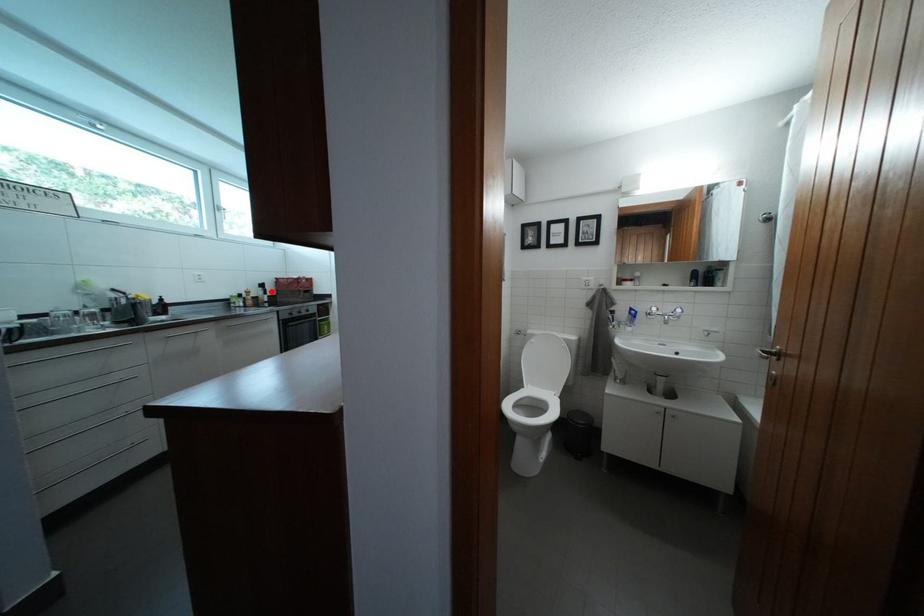
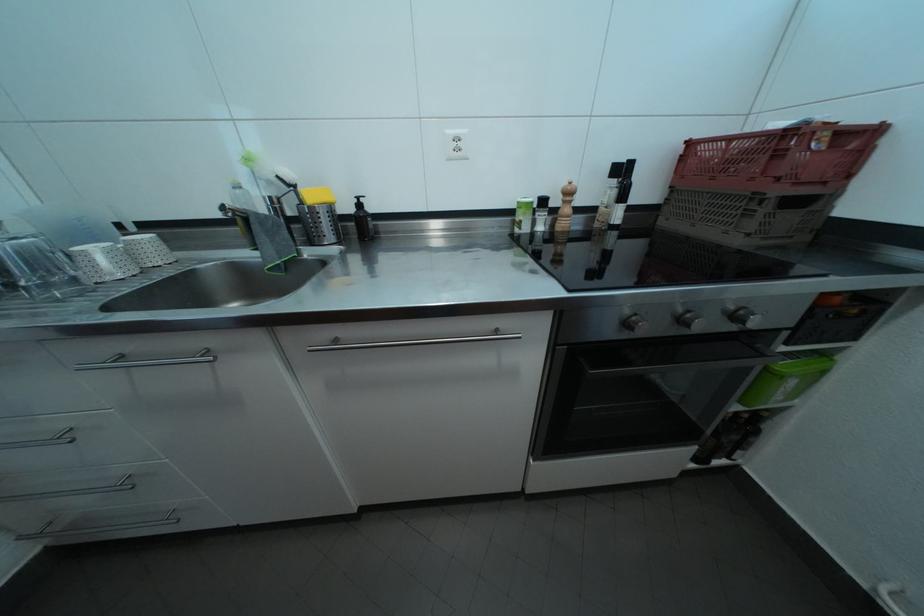
In the second image, find the point that corresponds to the highlighted location in the first image.

(630, 176)